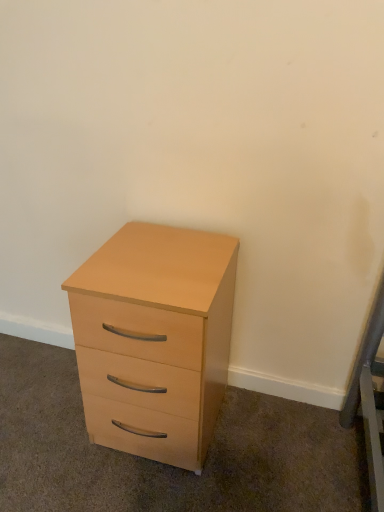
What are the coordinates of `free space in front of light wood/veneer chest of drawers at lower left` in the screenshot? It's located at (143, 489).